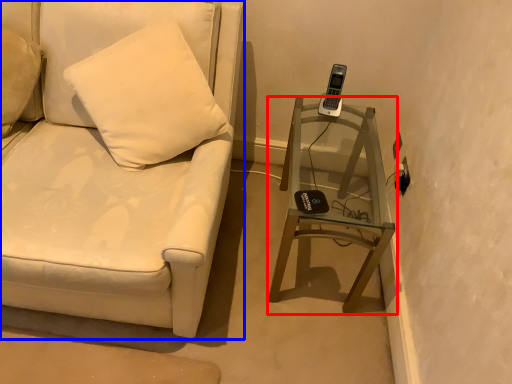
Question: Which object appears closest to the camera in this image, table (highlighted by a red box) or furniture (highlighted by a blue box)?

Choices:
 (A) table
 (B) furniture

Answer: (B)